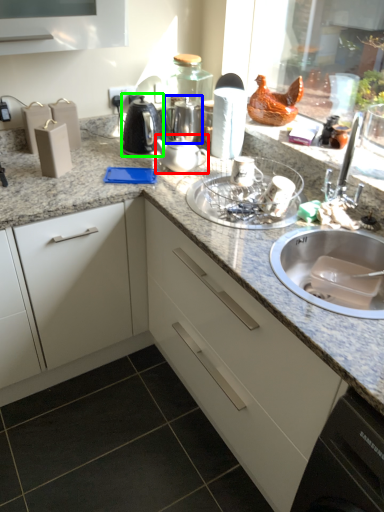
Question: Estimate the real-world distances between objects in this image. Which object is closer to tea pot (highlighted by a red box), tea pot (highlighted by a blue box) or kitchen appliance (highlighted by a green box)?

Choices:
 (A) tea pot
 (B) kitchen appliance

Answer: (B)